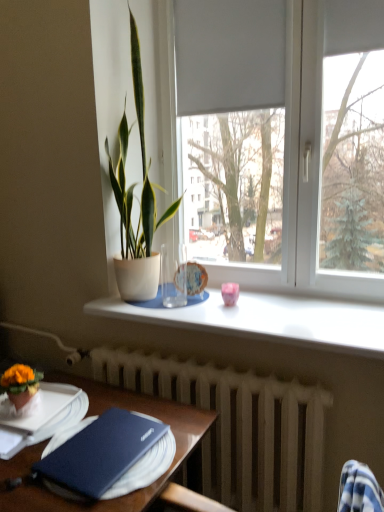
Where is `free space in front of orange felt flower pot at lower left, the 2th houseplant positioned from the top`? free space in front of orange felt flower pot at lower left, the 2th houseplant positioned from the top is located at coordinates (22, 433).